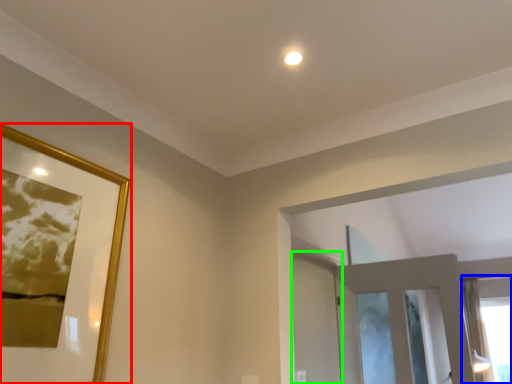
Question: Considering the real-world distances, which object is closest to picture frame (highlighted by a red box)? window (highlighted by a blue box) or screen door (highlighted by a green box).

Choices:
 (A) window
 (B) screen door

Answer: (B)